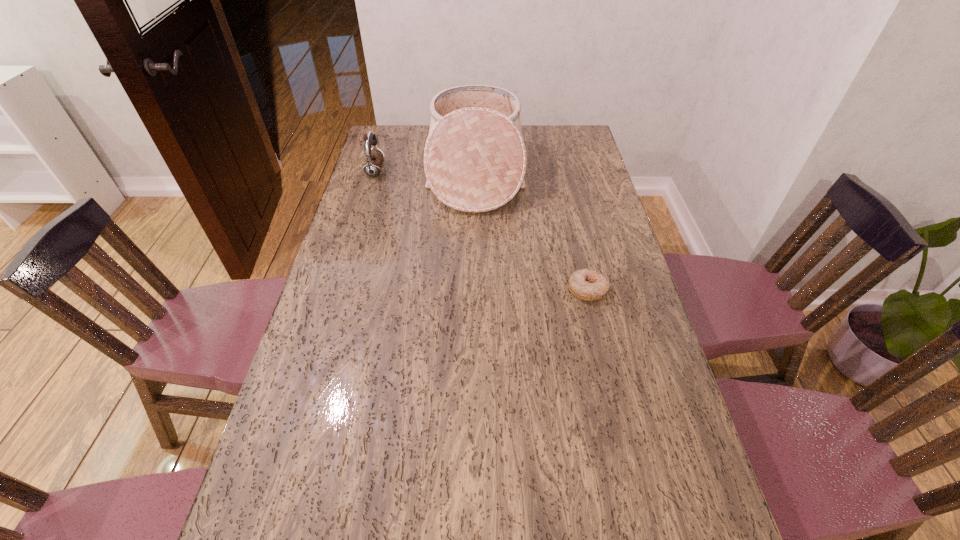
Image resolution: width=960 pixels, height=540 pixels. What are the coordinates of `the second object from left to right` in the screenshot? It's located at (475, 160).

Locate an element on the screen. Image resolution: width=960 pixels, height=540 pixels. the tallest object is located at coordinates (475, 160).

Where is `the leftmost object`? Image resolution: width=960 pixels, height=540 pixels. the leftmost object is located at coordinates coord(374,158).

You are a GUI agent. You are given a task and a screenshot of the screen. Output one action in this format:
    pyautogui.click(x=<x>, y=<y>)
    Task: Click on the earphone
    The height and width of the screenshot is (540, 960).
    Given the screenshot: What is the action you would take?
    pyautogui.click(x=374, y=158)

I want to click on doughnut, so click(x=586, y=284).

Where is `the shortest object`? This screenshot has height=540, width=960. the shortest object is located at coordinates (586, 284).

Identify the location of free space located with the lid open on the second object from left to right. The height and width of the screenshot is (540, 960). (550, 173).

Where is `free space located 0.050m on the ear pads of the leftmost object`? Image resolution: width=960 pixels, height=540 pixels. free space located 0.050m on the ear pads of the leftmost object is located at coordinates (396, 171).

The width and height of the screenshot is (960, 540). Find the location of `vacant area situated on the left of the nearest object`. vacant area situated on the left of the nearest object is located at coordinates (466, 289).

Where is `object that is positioned at the far edge`? This screenshot has height=540, width=960. object that is positioned at the far edge is located at coordinates (475, 160).